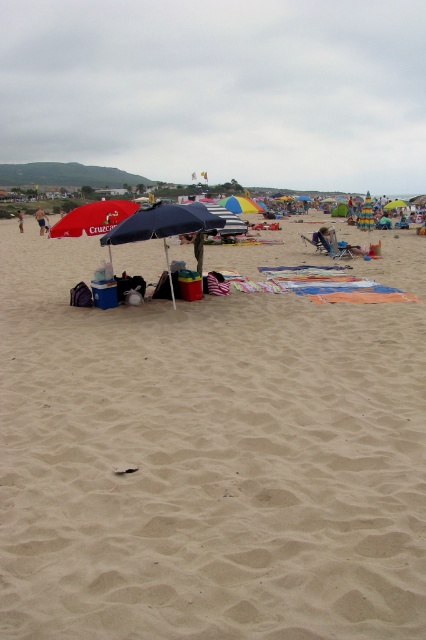
Which is above, matte blue umbrella at center or rainbow striped umbrella at center?

rainbow striped umbrella at center

What do you see at coordinates (163, 225) in the screenshot?
I see `matte blue umbrella at center` at bounding box center [163, 225].

Does point (134, 237) come behind point (241, 205)?

That is False.

Find the location of a particular element. This screenshot has width=426, height=640. matte blue umbrella at center is located at coordinates (163, 225).

Is rainbow striped umbrella at center wider than multicolored fabric umbrella at center?

No.

Can you confirm if rainbow striped umbrella at center is taller than multicolored fabric umbrella at center?

In fact, rainbow striped umbrella at center may be shorter than multicolored fabric umbrella at center.

Does point (261, 209) lie in front of point (368, 237)?

Yes, it is in front of point (368, 237).

Image resolution: width=426 pixels, height=640 pixels. I want to click on rainbow striped umbrella at center, so click(239, 204).

Between multicolored fabric umbrella at center and beige sand at center, which one is positioned higher?

multicolored fabric umbrella at center is higher up.

Is multicolored fabric umbrella at center below beige sand at center?

No, multicolored fabric umbrella at center is not below beige sand at center.

You are a GUI agent. You are given a task and a screenshot of the screen. Output one action in this format:
    pyautogui.click(x=<x>, y=<y>)
    Task: Click on the multicolored fabric umbrella at center
    
    Given the screenshot: What is the action you would take?
    pyautogui.click(x=367, y=216)

At what (x,y) coordinates should I click in order to perform the action: click on multicolored fabric umbrella at center. Please return your answer as a coordinate pair (x, y). The image size is (426, 640). Looking at the image, I should click on (367, 216).